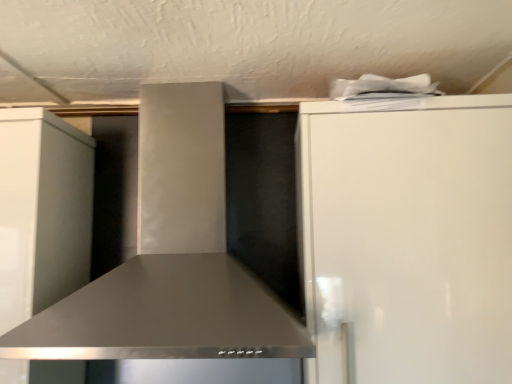
Question: From the image's perspective, is white glossy refrigerator at upper right below satin black range hood at center?

Choices:
 (A) no
 (B) yes

Answer: (B)

Question: Considering the relative sizes of white glossy refrigerator at upper right and satin black range hood at center in the image provided, is white glossy refrigerator at upper right thinner than satin black range hood at center?

Choices:
 (A) no
 (B) yes

Answer: (B)

Question: From a real-world perspective, is white glossy refrigerator at upper right beneath satin black range hood at center?

Choices:
 (A) yes
 (B) no

Answer: (A)

Question: Could you tell me if white glossy refrigerator at upper right is turned towards satin black range hood at center?

Choices:
 (A) no
 (B) yes

Answer: (A)

Question: Would you say satin black range hood at center is part of white glossy refrigerator at upper right's contents?

Choices:
 (A) yes
 (B) no

Answer: (B)

Question: Is the depth of white glossy refrigerator at upper right less than that of satin black range hood at center?

Choices:
 (A) yes
 (B) no

Answer: (B)

Question: Are satin black range hood at center and white glossy refrigerator at upper right making contact?

Choices:
 (A) yes
 (B) no

Answer: (B)

Question: Does satin black range hood at center have a greater height compared to white glossy refrigerator at upper right?

Choices:
 (A) no
 (B) yes

Answer: (A)

Question: Does satin black range hood at center appear on the right side of white glossy refrigerator at upper right?

Choices:
 (A) no
 (B) yes

Answer: (A)

Question: Can you confirm if satin black range hood at center is positioned to the left of white glossy refrigerator at upper right?

Choices:
 (A) no
 (B) yes

Answer: (B)

Question: Is satin black range hood at center oriented towards white glossy refrigerator at upper right?

Choices:
 (A) no
 (B) yes

Answer: (A)

Question: Is satin black range hood at center shorter than white glossy refrigerator at upper right?

Choices:
 (A) yes
 (B) no

Answer: (A)

Question: Is satin black range hood at center taller or shorter than white glossy refrigerator at upper right?

Choices:
 (A) tall
 (B) short

Answer: (B)